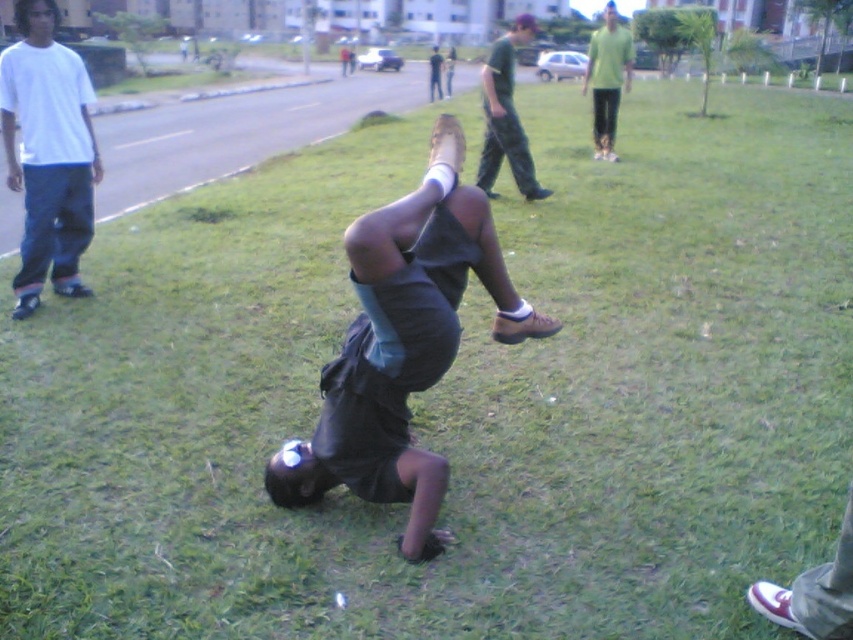
Question: Estimate the real-world distances between objects in this image. Which object is farther from the green matte shirt at upper right?

Choices:
 (A) dark gray shirt at center
 (B) white cotton shirt at left

Answer: (B)

Question: Which of the following is the farthest from the observer?

Choices:
 (A) dark gray shirt at center
 (B) white cotton shirt at left

Answer: (A)

Question: Considering the relative positions of green matte shirt at upper right and dark gray shirt at center in the image provided, where is green matte shirt at upper right located with respect to dark gray shirt at center?

Choices:
 (A) below
 (B) above

Answer: (A)

Question: Is dark gray fabric squat at center behind white cotton shirt at left?

Choices:
 (A) yes
 (B) no

Answer: (B)

Question: Among these objects, which one is nearest to the camera?

Choices:
 (A) dark green t-shirt at center
 (B) dark gray fabric squat at center

Answer: (B)

Question: In this image, where is dark green t-shirt at center located relative to dark gray shirt at center?

Choices:
 (A) below
 (B) above

Answer: (A)